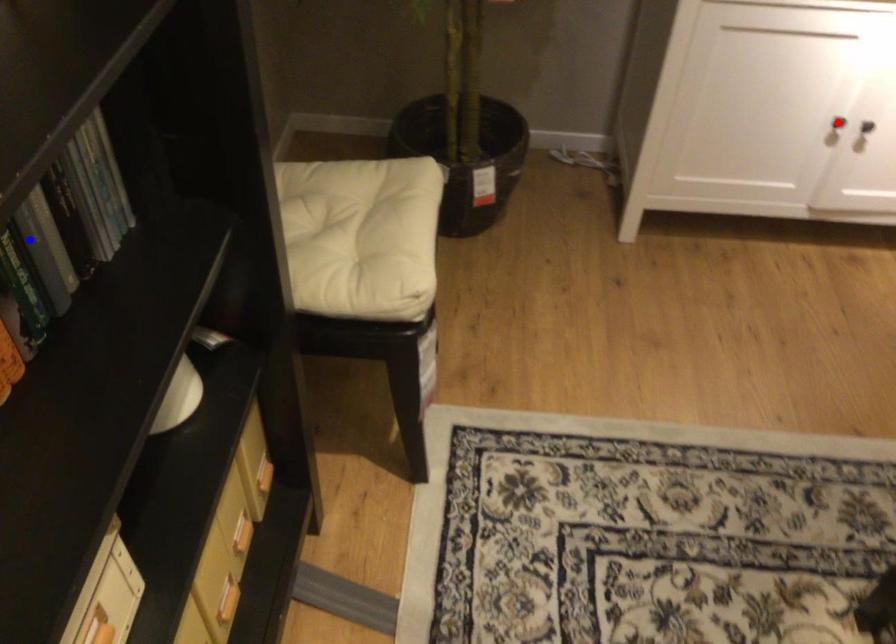
Question: Which of the two points in the image is closer to the camera?

Choices:
 (A) Blue point is closer.
 (B) Red point is closer.

Answer: (A)